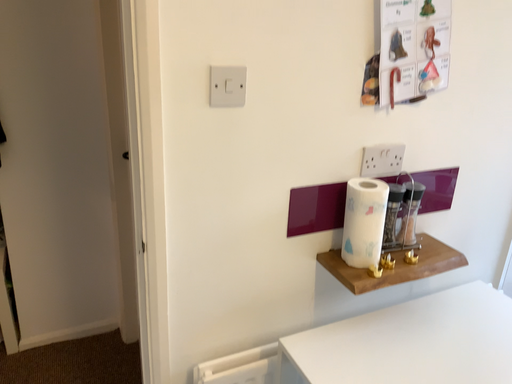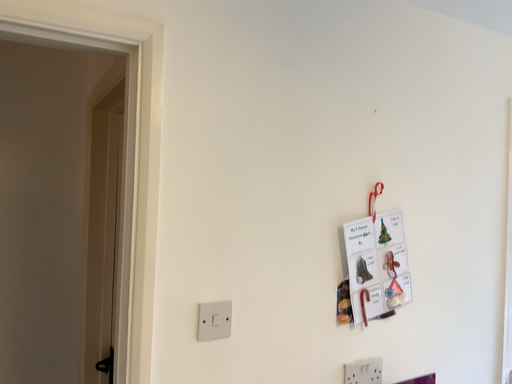
Question: How did the camera likely rotate when shooting the video?

Choices:
 (A) rotated downward
 (B) rotated upward

Answer: (B)